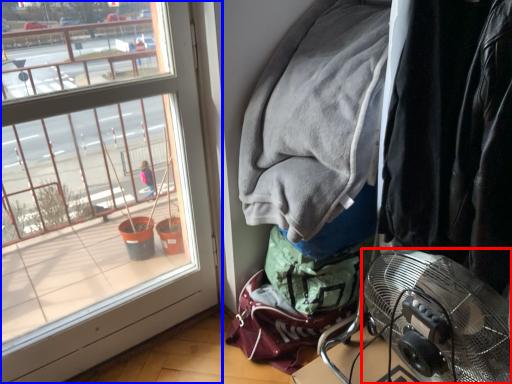
Question: Which of the following is the farthest to the observer, mechanical fan (highlighted by a red box) or window (highlighted by a blue box)?

Choices:
 (A) mechanical fan
 (B) window

Answer: (B)